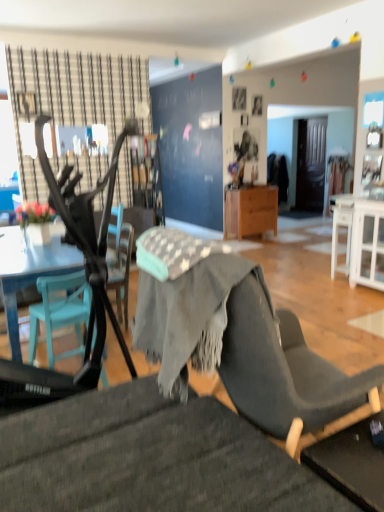
Question: Can you confirm if textured gray chair at lower center, arranged as the second chair when viewed from the back, is positioned to the left of teal plastic chair at left, which appears as the 2th chair when viewed from the front?

Choices:
 (A) no
 (B) yes

Answer: (A)

Question: From a real-world perspective, is textured gray chair at lower center, arranged as the second chair when viewed from the back, under teal plastic chair at left, which appears as the 2th chair when viewed from the front?

Choices:
 (A) yes
 (B) no

Answer: (B)

Question: Is textured gray chair at lower center, which ranks as the 1th chair in front-to-back order, positioned before teal plastic chair at left, the first chair viewed from the back?

Choices:
 (A) no
 (B) yes

Answer: (B)

Question: Can teal plastic chair at left, the first chair viewed from the back, be found inside textured gray chair at lower center, which ranks as the 1th chair in front-to-back order?

Choices:
 (A) yes
 (B) no

Answer: (B)

Question: Does textured gray chair at lower center, arranged as the second chair when viewed from the back, have a lesser height compared to teal plastic chair at left, the first chair viewed from the back?

Choices:
 (A) no
 (B) yes

Answer: (A)

Question: Based on their sizes in the image, would you say teal plastic chair at left, the first chair viewed from the back, is bigger or smaller than textured gray chair at lower center, arranged as the second chair when viewed from the back?

Choices:
 (A) big
 (B) small

Answer: (B)

Question: In the image, is teal plastic chair at left, the first chair viewed from the back, on the left side or the right side of textured gray chair at lower center, which ranks as the 1th chair in front-to-back order?

Choices:
 (A) right
 (B) left

Answer: (B)

Question: From their relative heights in the image, would you say teal plastic chair at left, which appears as the 2th chair when viewed from the front, is taller or shorter than textured gray chair at lower center, arranged as the second chair when viewed from the back?

Choices:
 (A) tall
 (B) short

Answer: (B)

Question: From the image's perspective, is teal plastic chair at left, which appears as the 2th chair when viewed from the front, located above or below textured gray chair at lower center, arranged as the second chair when viewed from the back?

Choices:
 (A) above
 (B) below

Answer: (A)

Question: From the image's perspective, is teal plastic chair at left, the first chair viewed from the back, located above or below metallic black feeding chair at left?

Choices:
 (A) below
 (B) above

Answer: (A)

Question: In terms of width, does teal plastic chair at left, the first chair viewed from the back, look wider or thinner when compared to metallic black feeding chair at left?

Choices:
 (A) wide
 (B) thin

Answer: (B)

Question: Is teal plastic chair at left, the first chair viewed from the back, bigger or smaller than metallic black feeding chair at left?

Choices:
 (A) small
 (B) big

Answer: (A)

Question: From a real-world perspective, is teal plastic chair at left, the first chair viewed from the back, physically located above or below metallic black feeding chair at left?

Choices:
 (A) above
 (B) below

Answer: (B)

Question: Is point (261, 206) positioned closer to the camera than point (77, 413)?

Choices:
 (A) closer
 (B) farther

Answer: (B)

Question: Based on their sizes in the image, would you say wooden cabinet at center is bigger or smaller than textured gray chair at lower center, which ranks as the 1th chair in front-to-back order?

Choices:
 (A) big
 (B) small

Answer: (B)